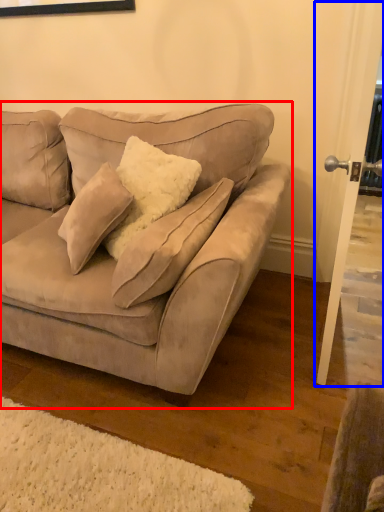
Question: Which point is closer to the camera, studio couch (highlighted by a red box) or screen door (highlighted by a blue box)?

Choices:
 (A) studio couch
 (B) screen door

Answer: (A)